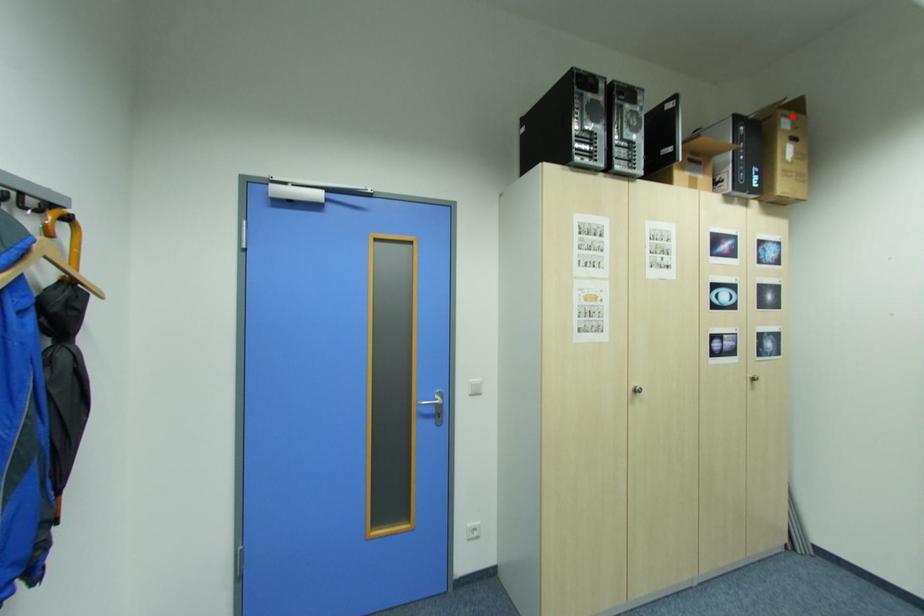
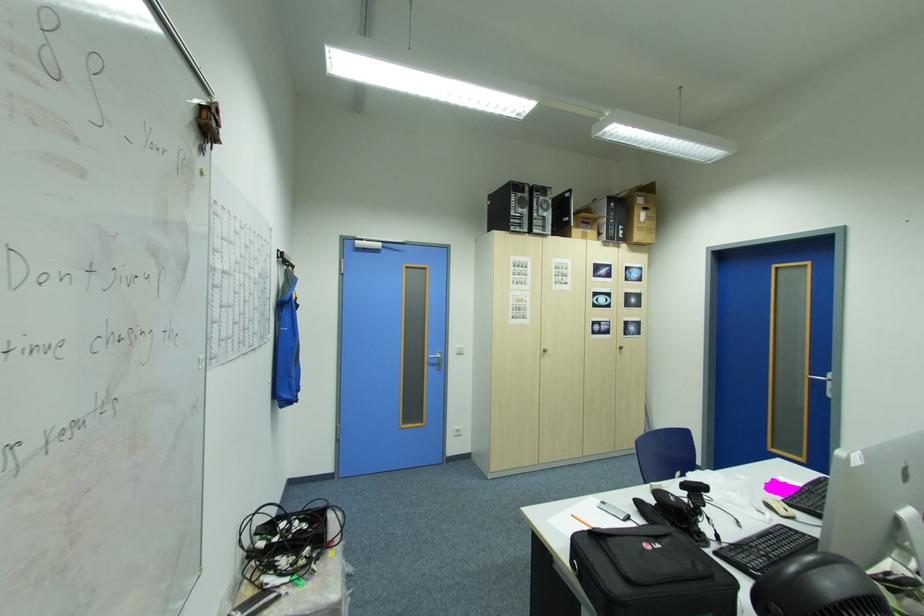
Question: I am providing you with two images of the same scene from different viewpoints. A red point is shown in image1. For the corresponding object point in image2, is it positioned nearer or farther from the camera?

Choices:
 (A) Nearer
 (B) Farther

Answer: (A)